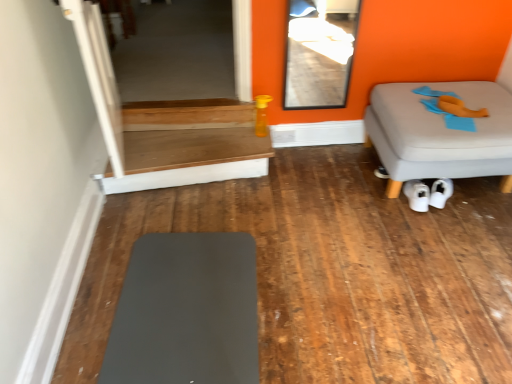
The image size is (512, 384). Identify the location of vacant area that lies between gray fabric ottoman at right, the 2th furniture when ordered from left to right, and wooden table at center. (306, 188).